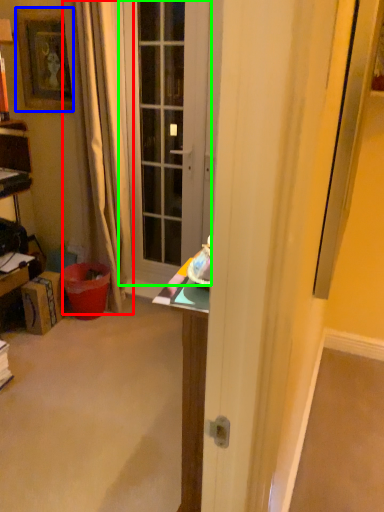
Question: Which object is positioned farthest from curtain (highlighted by a red box)? Select from picture frame (highlighted by a blue box) and door (highlighted by a green box).

Choices:
 (A) picture frame
 (B) door

Answer: (B)